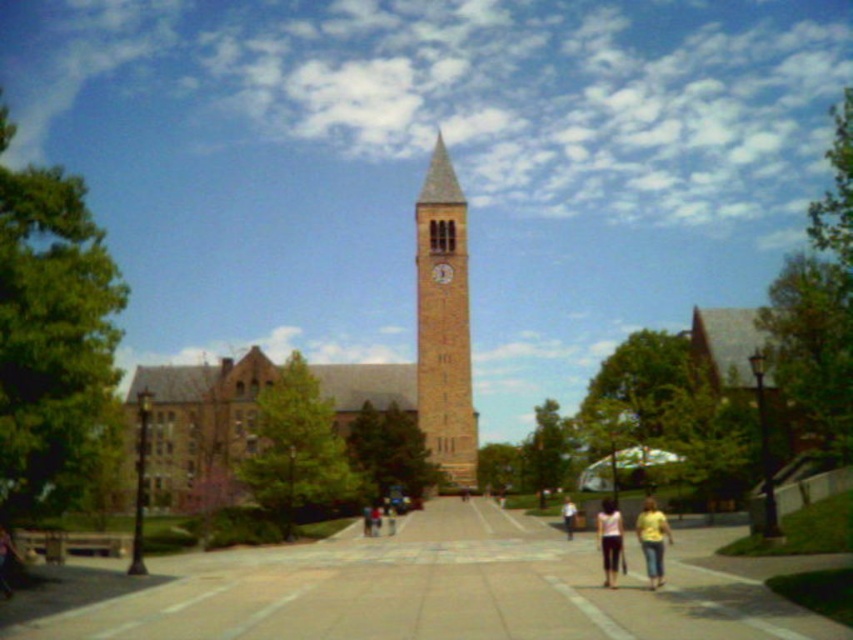
Can you confirm if brown brick clock tower at center is wider than light blue jeans at center?

Yes, brown brick clock tower at center is wider than light blue jeans at center.

Is brown brick clock tower at center to the left of light blue jeans at center from the viewer's perspective?

Correct, you'll find brown brick clock tower at center to the left of light blue jeans at center.

Identify the location of brown brick clock tower at center. (444, 323).

Where is `brown brick clock tower at center`? Image resolution: width=853 pixels, height=640 pixels. brown brick clock tower at center is located at coordinates (444, 323).

Does point (432, 452) come behind point (636, 531)?

Yes.

Is brown brick clock tower at center bigger than yellow matte shirt at lower right?

Correct, brown brick clock tower at center is larger in size than yellow matte shirt at lower right.

Describe the element at coordinates (444, 323) in the screenshot. I see `brown brick clock tower at center` at that location.

This screenshot has height=640, width=853. Identify the location of brown brick clock tower at center. (444, 323).

Can you confirm if yellow matte shirt at lower right is shorter than white cotton tank top at center?

Correct, yellow matte shirt at lower right is not as tall as white cotton tank top at center.

At what (x,y) coordinates should I click in order to perform the action: click on yellow matte shirt at lower right. Please return your answer as a coordinate pair (x, y). Image resolution: width=853 pixels, height=640 pixels. Looking at the image, I should click on [x=653, y=540].